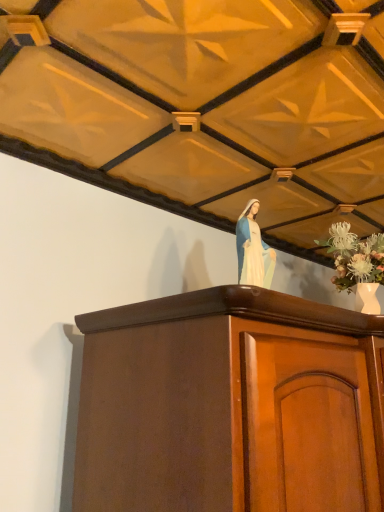
Question: Is white porcelain vase at upper right positioned behind mahogany cabinet at center?

Choices:
 (A) yes
 (B) no

Answer: (A)

Question: Is white porcelain vase at upper right touching mahogany cabinet at center?

Choices:
 (A) no
 (B) yes

Answer: (A)

Question: From a real-world perspective, is white porcelain vase at upper right on mahogany cabinet at center?

Choices:
 (A) no
 (B) yes

Answer: (B)

Question: Does white porcelain vase at upper right appear on the left side of mahogany cabinet at center?

Choices:
 (A) yes
 (B) no

Answer: (B)

Question: Considering the relative sizes of white porcelain vase at upper right and mahogany cabinet at center in the image provided, is white porcelain vase at upper right bigger than mahogany cabinet at center?

Choices:
 (A) no
 (B) yes

Answer: (A)

Question: Based on their positions, is mahogany cabinet at center located to the left or right of white porcelain statue at upper center?

Choices:
 (A) left
 (B) right

Answer: (B)

Question: Considering the positions of mahogany cabinet at center and white porcelain statue at upper center in the image, is mahogany cabinet at center taller or shorter than white porcelain statue at upper center?

Choices:
 (A) short
 (B) tall

Answer: (B)

Question: Considering the positions of point (162, 467) and point (256, 261), is point (162, 467) closer or farther from the camera than point (256, 261)?

Choices:
 (A) closer
 (B) farther

Answer: (A)

Question: From the image's perspective, is mahogany cabinet at center located above or below white porcelain statue at upper center?

Choices:
 (A) below
 (B) above

Answer: (A)

Question: Looking at their shapes, would you say white porcelain statue at upper center is wider or thinner than mahogany cabinet at center?

Choices:
 (A) thin
 (B) wide

Answer: (A)

Question: From their relative heights in the image, would you say white porcelain statue at upper center is taller or shorter than mahogany cabinet at center?

Choices:
 (A) tall
 (B) short

Answer: (B)

Question: Based on their sizes in the image, would you say white porcelain statue at upper center is bigger or smaller than mahogany cabinet at center?

Choices:
 (A) small
 (B) big

Answer: (A)

Question: From a real-world perspective, is white porcelain statue at upper center physically located above or below mahogany cabinet at center?

Choices:
 (A) above
 (B) below

Answer: (A)

Question: Looking at the image, does mahogany cabinet at center seem bigger or smaller compared to white porcelain vase at upper right?

Choices:
 (A) big
 (B) small

Answer: (A)

Question: Do you think mahogany cabinet at center is within white porcelain vase at upper right, or outside of it?

Choices:
 (A) inside
 (B) outside

Answer: (B)